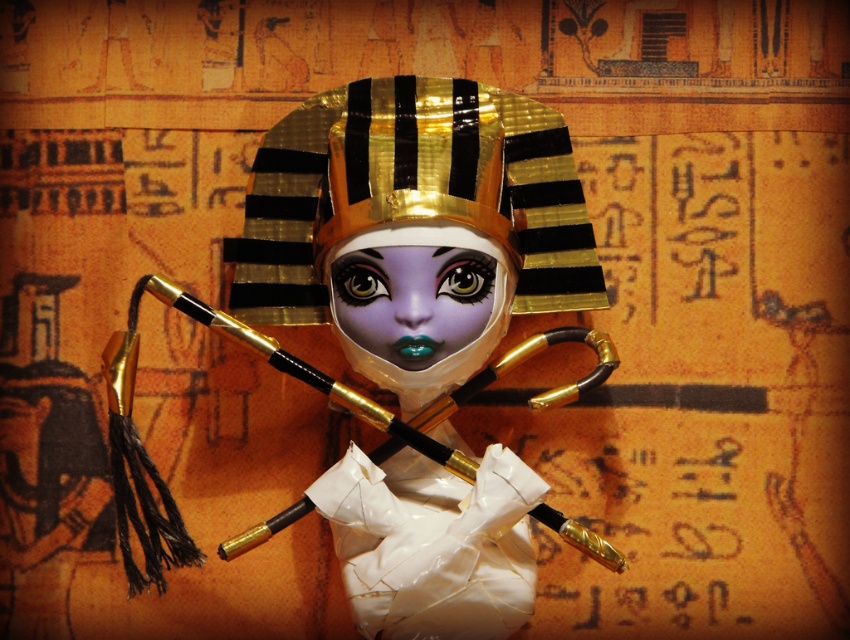
Question: Which object is farther from the camera taking this photo?

Choices:
 (A) matte purple eye at center
 (B) gold/black striped headdress at center
 (C) shiny purple eye at center

Answer: (A)

Question: Does shiny purple eye at center appear on the right side of matte purple eye at center?

Choices:
 (A) no
 (B) yes

Answer: (B)

Question: Does gold/black striped headdress at center lie behind shiny purple eye at center?

Choices:
 (A) no
 (B) yes

Answer: (A)

Question: Is shiny purple eye at center above matte purple eye at center?

Choices:
 (A) no
 (B) yes

Answer: (B)

Question: Which of the following is the closest to the observer?

Choices:
 (A) (333, 275)
 (B) (275, 310)

Answer: (A)

Question: Which object appears farthest from the camera in this image?

Choices:
 (A) gold/black striped headdress at center
 (B) matte purple eye at center
 (C) shiny purple eye at center

Answer: (B)